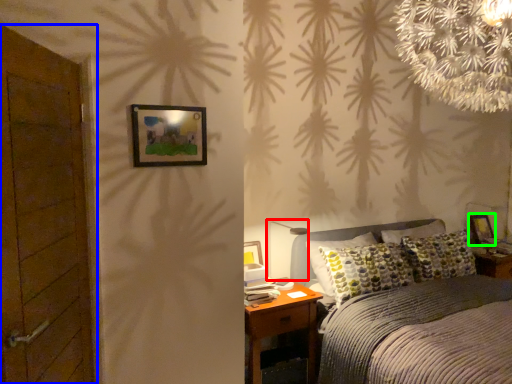
Question: Which is nearer to the table lamp (highlighted by a red box)? door (highlighted by a blue box) or picture frame (highlighted by a green box).

Choices:
 (A) door
 (B) picture frame

Answer: (A)